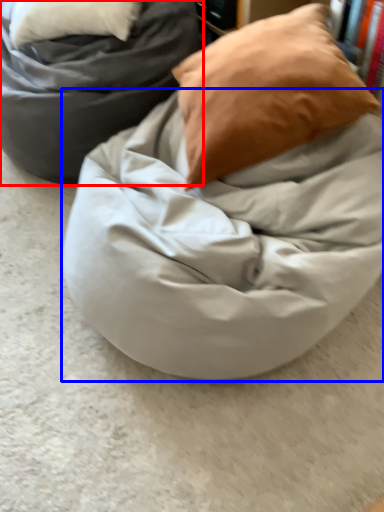
Question: Which object appears farthest to the camera in this image, furniture (highlighted by a red box) or blanket (highlighted by a blue box)?

Choices:
 (A) furniture
 (B) blanket

Answer: (A)